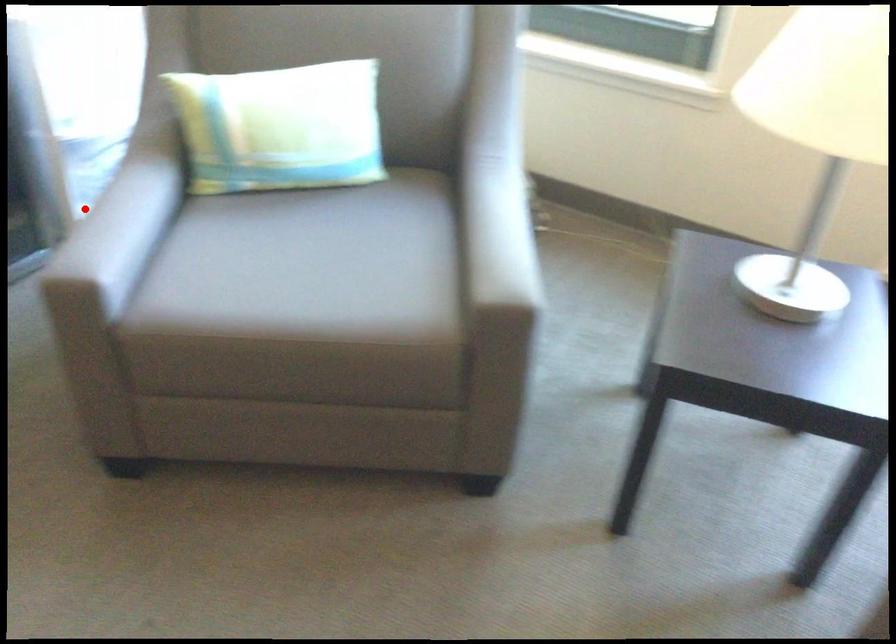
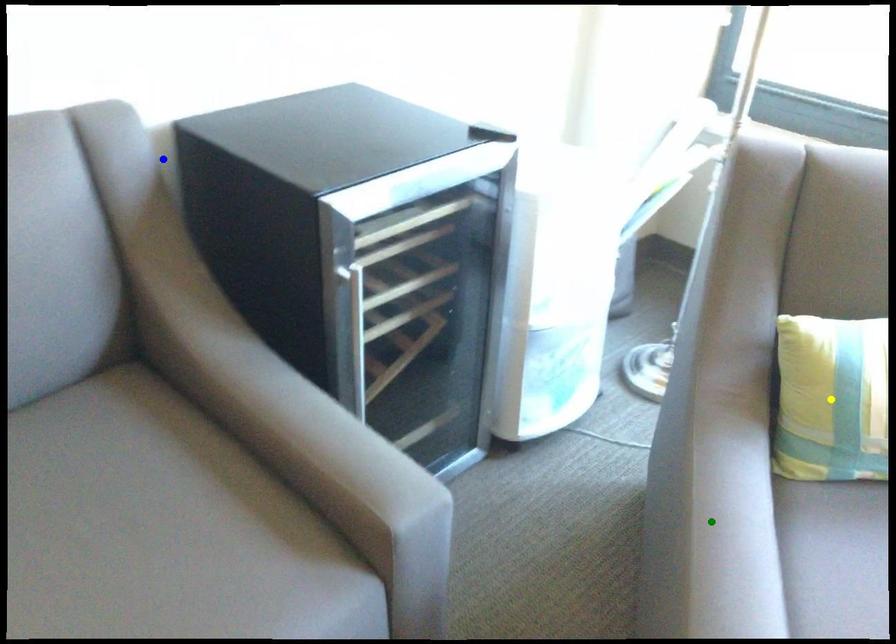
Question: I am providing you with two images of the same scene from different viewpoints. A red point is marked on the first image. You are given multiple points on the second image. In image 2, which mark is for the same physical point as the one in image 1?

Choices:
 (A) yellow point
 (B) green point
 (C) blue point

Answer: (B)